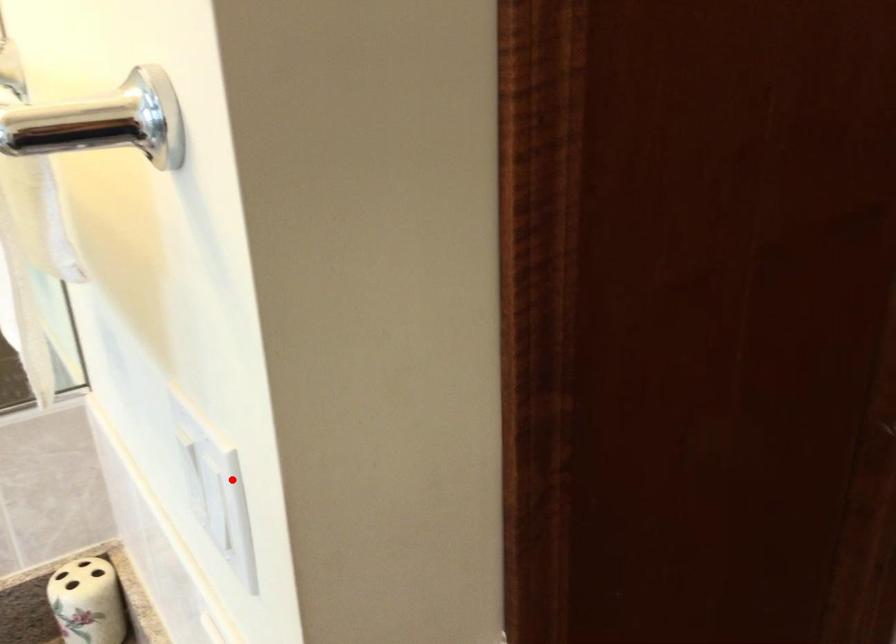
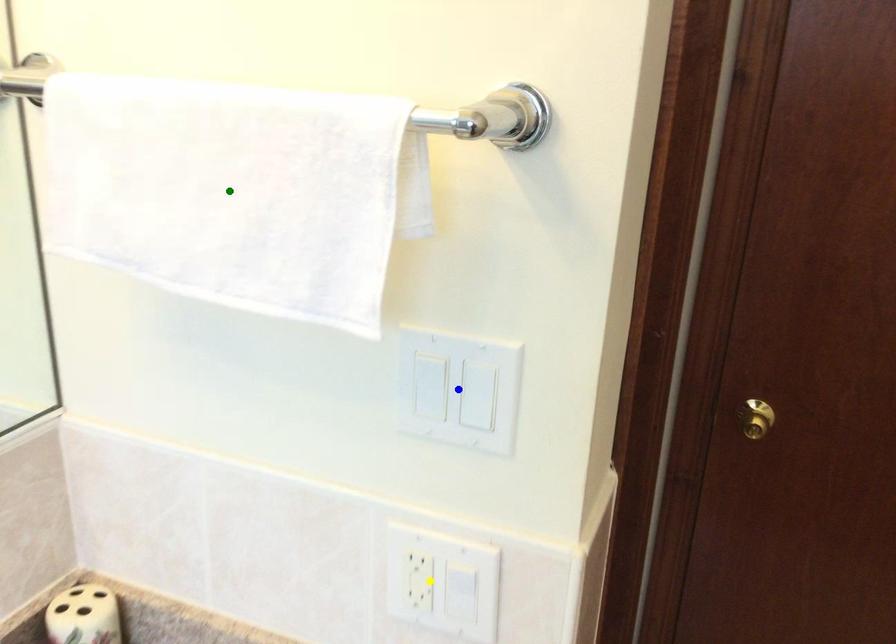
Question: I am providing you with two images of the same scene from different viewpoints. A red point is marked on the first image. You are given multiple points on the second image. Which spot in image 2 lines up with the point in image 1?

Choices:
 (A) blue point
 (B) green point
 (C) yellow point

Answer: (A)